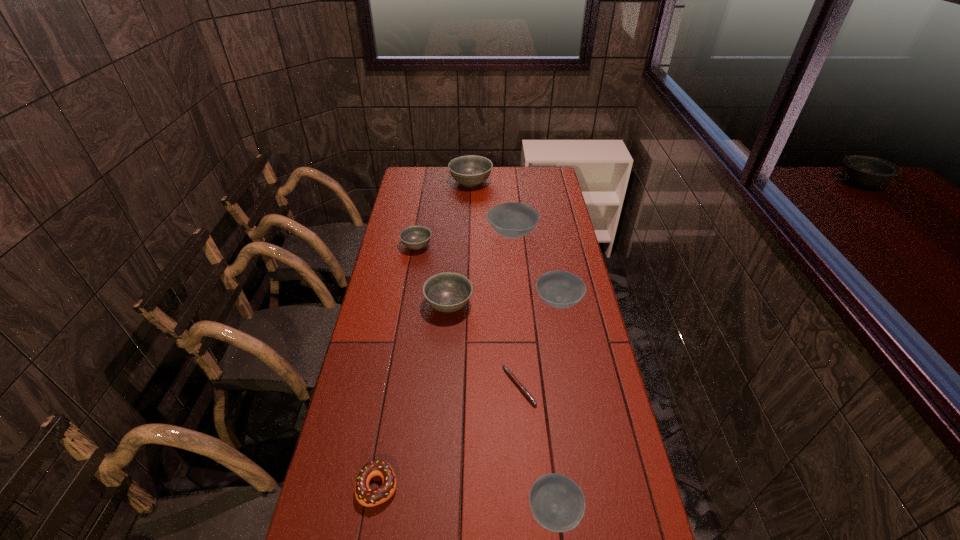
Image resolution: width=960 pixels, height=540 pixels. Find the location of `blank area located on the left of the biggest gray bowl`. blank area located on the left of the biggest gray bowl is located at coordinates (423, 183).

You are a GUI agent. You are given a task and a screenshot of the screen. Output one action in this format:
    pyautogui.click(x=<x>, y=<y>)
    Task: Click on the free space located 0.170m on the left of the farthest brown bowl
    The height and width of the screenshot is (540, 960).
    Given the screenshot: What is the action you would take?
    pyautogui.click(x=447, y=234)

Where is `vacant space located on the back of the second biggest gray bowl`? The width and height of the screenshot is (960, 540). vacant space located on the back of the second biggest gray bowl is located at coordinates (454, 230).

Find the location of `free space located on the front of the second smallest brown bowl`. free space located on the front of the second smallest brown bowl is located at coordinates (580, 413).

I want to click on vacant space located on the back of the smallest gray bowl, so click(420, 223).

This screenshot has height=540, width=960. Identify the location of blank area located 0.240m on the back of the doughnut. (395, 388).

Find the location of a particular element. free space located 0.190m at the nib of the third nearest object is located at coordinates (442, 386).

Find the location of a particular element. Image resolution: width=960 pixels, height=540 pixels. vacant space situated 0.380m at the nib of the third nearest object is located at coordinates (380, 386).

The width and height of the screenshot is (960, 540). In order to click on blank area located 0.220m at the nib of the third nearest object in this screenshot , I will do `click(432, 386)`.

Identify the location of object positioned at the far edge. This screenshot has width=960, height=540. (471, 170).